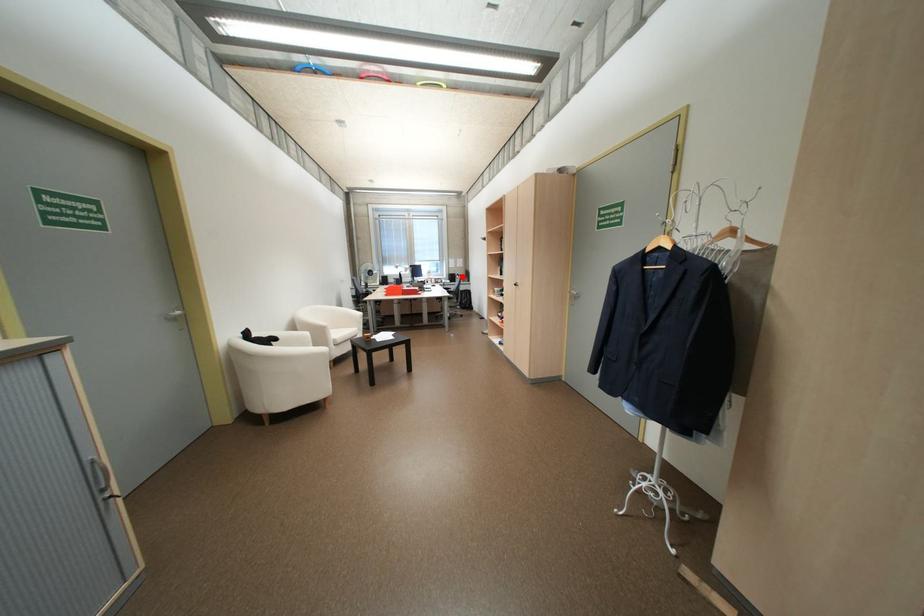
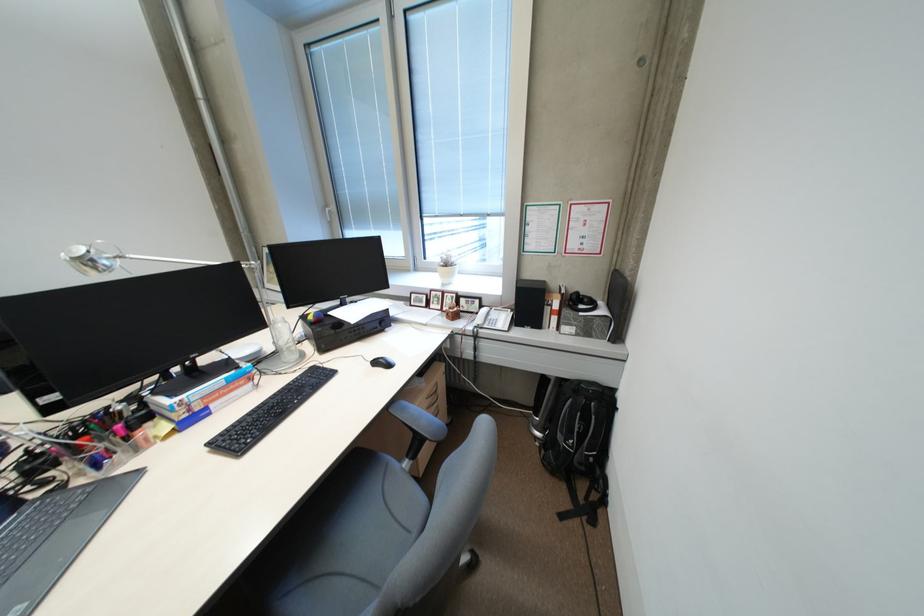
Locate, in the second image, the point that corresponds to the highlighted location in the first image.

(538, 302)